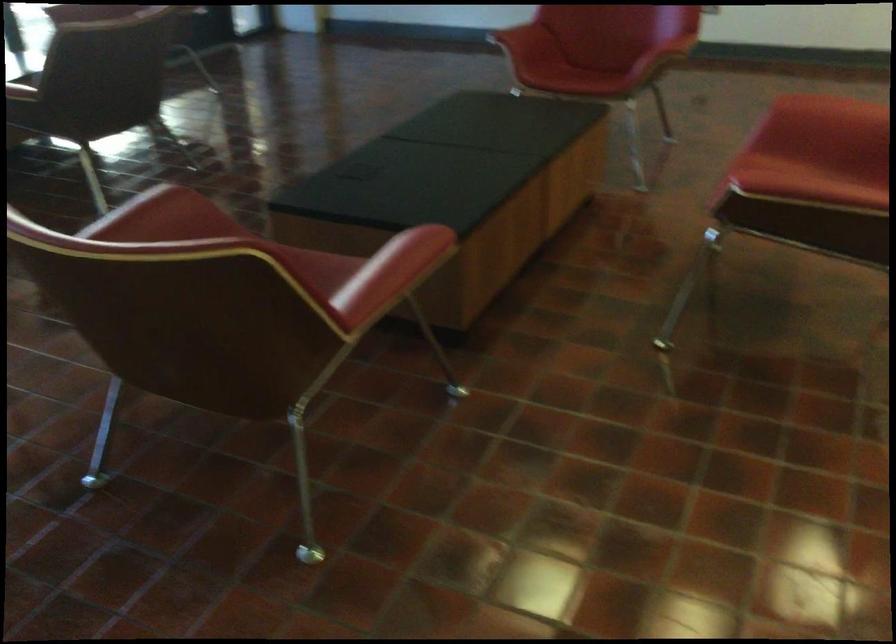
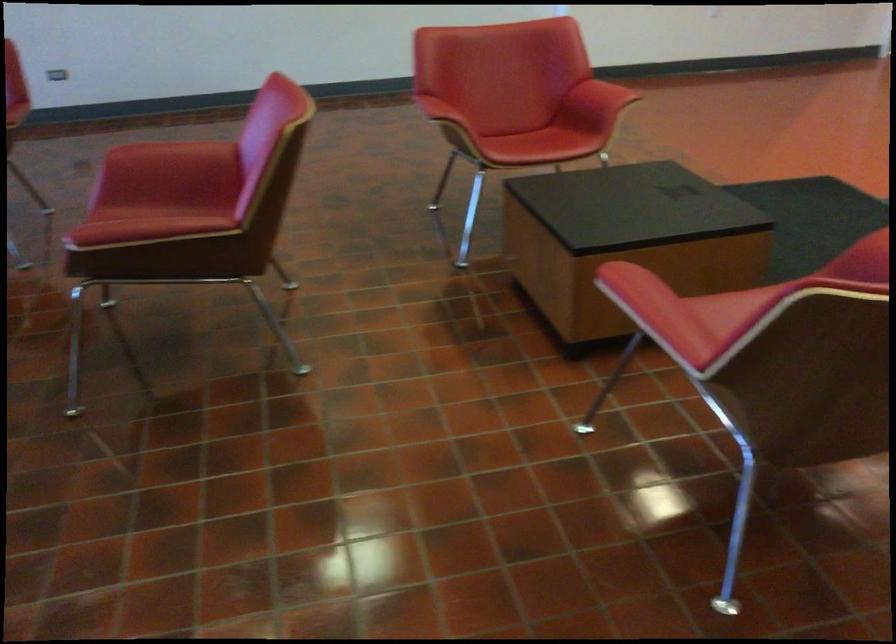
Question: The images are taken continuously from a first-person perspective. In which direction is your viewpoint rotating?

Choices:
 (A) Left
 (B) Right
 (C) Up
 (D) Down

Answer: (B)